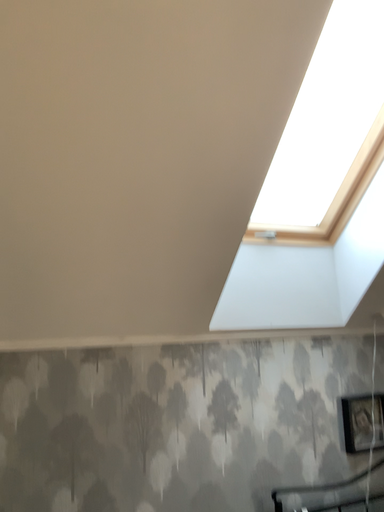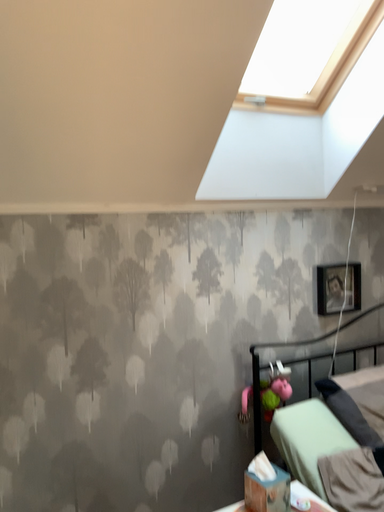
Question: Which way did the camera rotate in the video?

Choices:
 (A) rotated upward
 (B) rotated downward

Answer: (B)